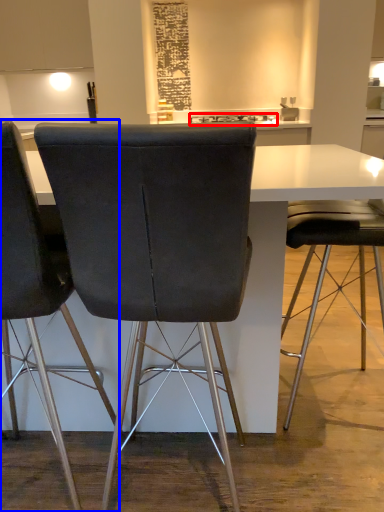
Question: Which point is further to the camera, appliance (highlighted by a red box) or chair (highlighted by a blue box)?

Choices:
 (A) appliance
 (B) chair

Answer: (A)